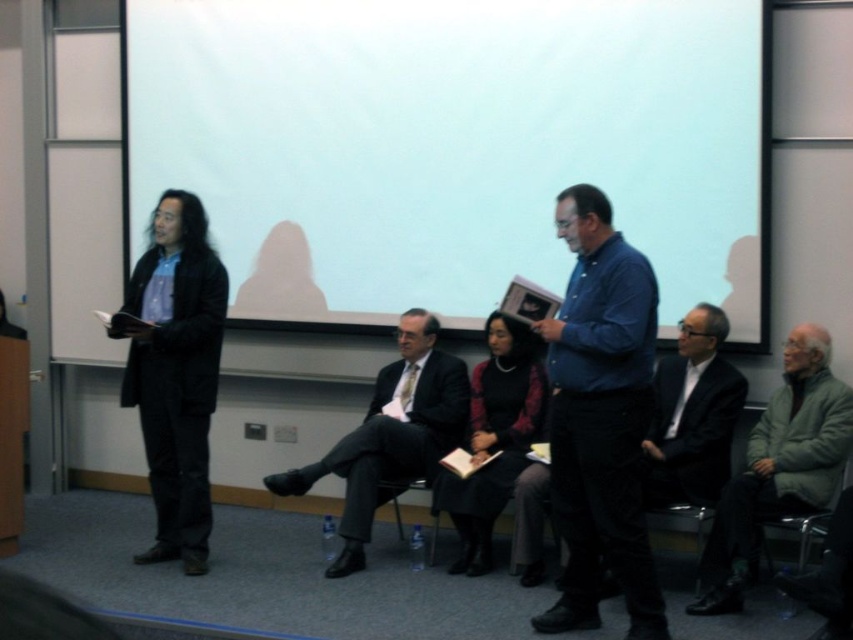
Question: Based on their relative distances, which object is nearer to the dark gray plastic chair at lower right?

Choices:
 (A) dark red knit sweater at center
 (B) white matte projection screen at upper center
 (C) black matte suit at left

Answer: (A)

Question: Can you confirm if gray woolen sweater at right is thinner than dark red knit sweater at center?

Choices:
 (A) yes
 (B) no

Answer: (B)

Question: Considering the real-world distances, which object is farthest from the dark red knit sweater at center?

Choices:
 (A) blue denim shirt at center
 (B) gray woolen sweater at right
 (C) dark gray plastic chair at lower right

Answer: (C)

Question: Which of the following is the farthest from the observer?

Choices:
 (A) blue denim shirt at center
 (B) white matte projection screen at upper center
 (C) dark suit at center

Answer: (C)

Question: Can you confirm if blue denim shirt at center is positioned above dark gray plastic chair at lower right?

Choices:
 (A) yes
 (B) no

Answer: (A)

Question: Does blue denim shirt at center come in front of dark gray plastic chair at lower right?

Choices:
 (A) yes
 (B) no

Answer: (A)